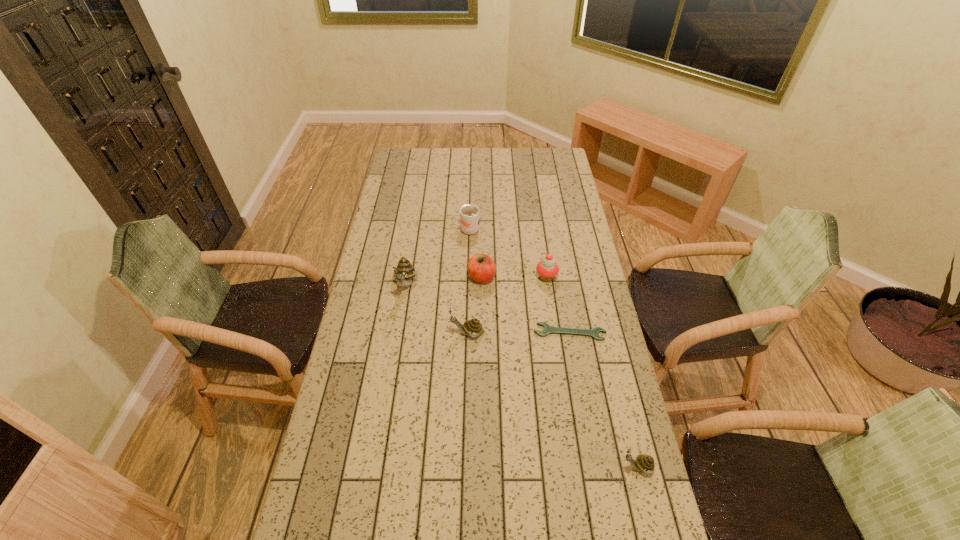
The image size is (960, 540). I want to click on vacant point located on the side with the handle of the farthest object, so click(x=394, y=230).

The width and height of the screenshot is (960, 540). In order to click on vacant space located 0.190m on the back of the shortest object in this screenshot , I will do point(562,285).

Identify the location of free point located 0.080m on the left of the apple. The height and width of the screenshot is (540, 960). (447, 277).

The image size is (960, 540). Find the location of `object present at the left edge`. object present at the left edge is located at coordinates (404, 271).

Locate an element on the screen. The width and height of the screenshot is (960, 540). snail at the right edge is located at coordinates click(645, 463).

I want to click on cupcake situated at the right edge, so click(x=547, y=269).

Where is `wrench that is at the right edge`? wrench that is at the right edge is located at coordinates (548, 329).

In the image, there is a desktop. Where is `vacant space at the far edge`? Image resolution: width=960 pixels, height=540 pixels. vacant space at the far edge is located at coordinates (487, 153).

Find the location of a particular element. The width and height of the screenshot is (960, 540). vacant point at the left edge is located at coordinates (402, 200).

In the image, there is a desktop. Identify the location of free space at the right edge. (547, 205).